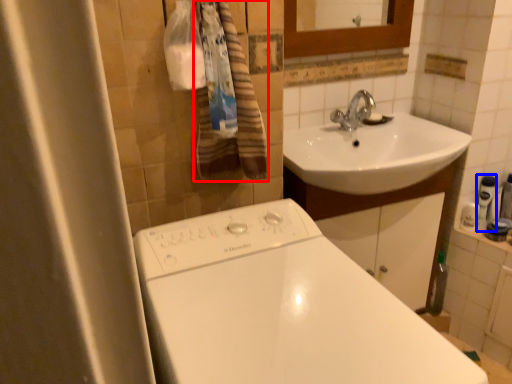
Question: Among these objects, which one is nearest to the camera, bath towel (highlighted by a red box) or toiletry (highlighted by a blue box)?

Choices:
 (A) bath towel
 (B) toiletry

Answer: (A)